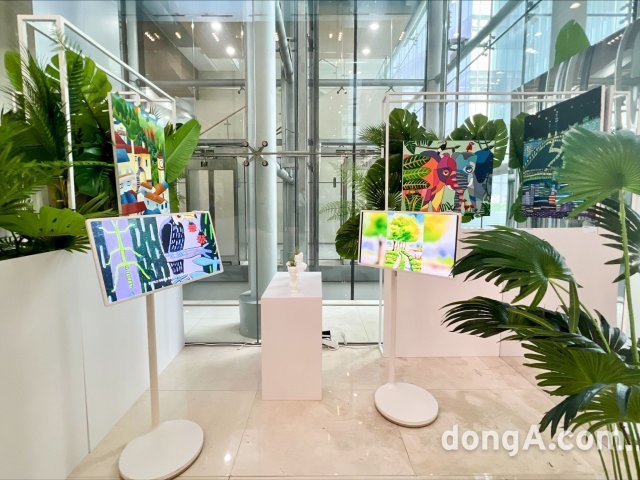
This screenshot has width=640, height=480. In order to click on overhead lights in this screenshot , I will do `click(212, 26)`, `click(232, 47)`, `click(372, 26)`, `click(368, 50)`.